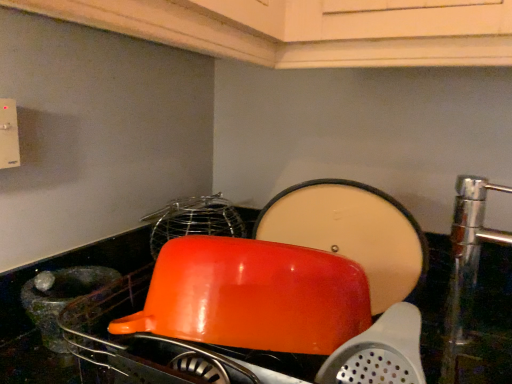
Question: Considering the relative sizes of translucent glass mortar at left and glossy orange bowl at center in the image provided, is translucent glass mortar at left smaller than glossy orange bowl at center?

Choices:
 (A) yes
 (B) no

Answer: (A)

Question: Is translucent glass mortar at left thinner than glossy orange bowl at center?

Choices:
 (A) no
 (B) yes

Answer: (B)

Question: Is translucent glass mortar at left wider than glossy orange bowl at center?

Choices:
 (A) yes
 (B) no

Answer: (B)

Question: Is translucent glass mortar at left touching glossy orange bowl at center?

Choices:
 (A) yes
 (B) no

Answer: (B)

Question: Considering the relative sizes of translucent glass mortar at left and glossy orange bowl at center in the image provided, is translucent glass mortar at left taller than glossy orange bowl at center?

Choices:
 (A) no
 (B) yes

Answer: (A)

Question: Is translucent glass mortar at left facing away from glossy orange bowl at center?

Choices:
 (A) yes
 (B) no

Answer: (B)

Question: Is translucent glass mortar at left positioned in front of glossy plastic bowl at center?

Choices:
 (A) no
 (B) yes

Answer: (A)

Question: Considering the relative sizes of translucent glass mortar at left and glossy plastic bowl at center in the image provided, is translucent glass mortar at left wider than glossy plastic bowl at center?

Choices:
 (A) no
 (B) yes

Answer: (A)

Question: Considering the relative sizes of translucent glass mortar at left and glossy plastic bowl at center in the image provided, is translucent glass mortar at left taller than glossy plastic bowl at center?

Choices:
 (A) no
 (B) yes

Answer: (A)

Question: Is translucent glass mortar at left far away from glossy plastic bowl at center?

Choices:
 (A) yes
 (B) no

Answer: (B)

Question: From a real-world perspective, is translucent glass mortar at left physically above glossy plastic bowl at center?

Choices:
 (A) no
 (B) yes

Answer: (A)

Question: Is glossy plastic bowl at center located within translucent glass mortar at left?

Choices:
 (A) no
 (B) yes

Answer: (A)

Question: Does glossy plastic bowl at center come behind glossy orange bowl at center?

Choices:
 (A) yes
 (B) no

Answer: (B)